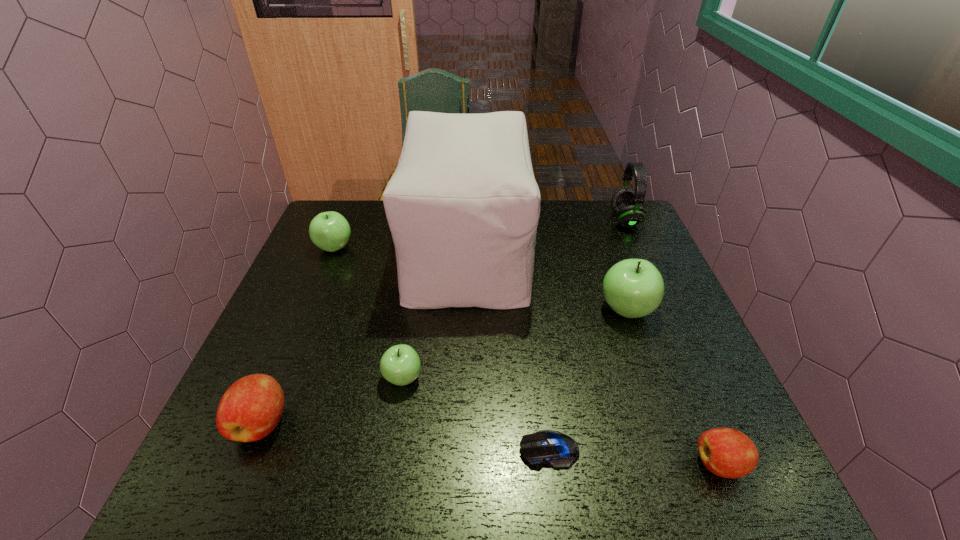
Locate an element on the screen. The width and height of the screenshot is (960, 540). white cushion is located at coordinates (463, 206).

Find the location of a particular element. the tallest object is located at coordinates (463, 206).

Image resolution: width=960 pixels, height=540 pixels. I want to click on the seventh shortest object, so click(626, 203).

Identify the location of headset. (626, 203).

You are a GUI agent. You are given a task and a screenshot of the screen. Output one action in this format:
    pyautogui.click(x=<x>, y=<y>)
    Task: Click on the second farthest apple
    
    Given the screenshot: What is the action you would take?
    pyautogui.click(x=633, y=288)

You are a GUI agent. You are given a task and a screenshot of the screen. Output one action in this format:
    pyautogui.click(x=<x>, y=<y>)
    Task: Click on the second nearest green apple
    The width and height of the screenshot is (960, 540).
    Given the screenshot: What is the action you would take?
    pyautogui.click(x=633, y=288)

The width and height of the screenshot is (960, 540). I want to click on the farthest green apple, so click(x=330, y=231).

The height and width of the screenshot is (540, 960). I want to click on the leftmost green apple, so click(x=330, y=231).

What are the coordinates of `the bigger red apple` in the screenshot? It's located at (250, 409).

You are a GUI agent. You are given a task and a screenshot of the screen. Output one action in this format:
    pyautogui.click(x=<x>, y=<y>)
    Task: Click on the third nearest apple
    This screenshot has width=960, height=540.
    Given the screenshot: What is the action you would take?
    pyautogui.click(x=400, y=365)